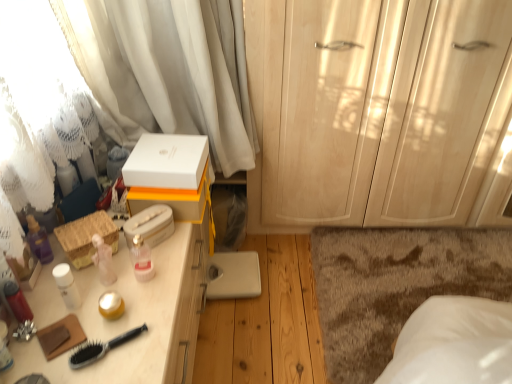
Question: Is white matte box at center, which appears as the third storage box when ordered from the bottom, closer to camera compared to brown shaggy rug at lower right?

Choices:
 (A) yes
 (B) no

Answer: (A)

Question: Is white matte box at center, the first storage box from the top, to the left of brown shaggy rug at lower right from the viewer's perspective?

Choices:
 (A) no
 (B) yes

Answer: (B)

Question: Is the position of white matte box at center, which appears as the third storage box when ordered from the bottom, more distant than that of brown shaggy rug at lower right?

Choices:
 (A) yes
 (B) no

Answer: (B)

Question: Can you confirm if white matte box at center, which appears as the third storage box when ordered from the bottom, is smaller than brown shaggy rug at lower right?

Choices:
 (A) no
 (B) yes

Answer: (B)

Question: Is white matte box at center, which appears as the third storage box when ordered from the bottom, placed right next to brown shaggy rug at lower right?

Choices:
 (A) no
 (B) yes

Answer: (A)

Question: Considering the relative positions of white matte box at center, the first storage box from the top, and white matte tissue box at upper center, positioned as the 2th storage box in top-to-bottom order, in the image provided, is white matte box at center, the first storage box from the top, to the left or to the right of white matte tissue box at upper center, positioned as the 2th storage box in top-to-bottom order,?

Choices:
 (A) right
 (B) left

Answer: (A)

Question: Considering the positions of white matte box at center, which appears as the third storage box when ordered from the bottom, and white matte tissue box at upper center, positioned as the 2th storage box in top-to-bottom order, in the image, is white matte box at center, which appears as the third storage box when ordered from the bottom, bigger or smaller than white matte tissue box at upper center, positioned as the 2th storage box in top-to-bottom order,?

Choices:
 (A) small
 (B) big

Answer: (B)

Question: Does point (159, 187) appear closer or farther from the camera than point (170, 213)?

Choices:
 (A) farther
 (B) closer

Answer: (B)

Question: From a real-world perspective, relative to white matte tissue box at upper center, arranged as the second storage box when ordered from the bottom, is white matte box at center, the first storage box from the top, vertically above or below?

Choices:
 (A) above
 (B) below

Answer: (A)

Question: Is white matte box at center, the first storage box from the top, taller or shorter than matte white lotion at left, placed as the 1th toiletry when sorted from left to right?

Choices:
 (A) short
 (B) tall

Answer: (A)

Question: In the image, is white matte box at center, the first storage box from the top, positioned in front of or behind matte white lotion at left, which is the first toiletry in bottom-to-top order?

Choices:
 (A) front
 (B) behind

Answer: (B)

Question: From the image's perspective, relative to matte white lotion at left, which ranks as the first toiletry in front-to-back order, is white matte box at center, which appears as the third storage box when ordered from the bottom, above or below?

Choices:
 (A) below
 (B) above

Answer: (B)

Question: From a real-world perspective, is white matte box at center, the first storage box from the top, positioned above or below matte white lotion at left, which is the second toiletry in back-to-front order?

Choices:
 (A) above
 (B) below

Answer: (A)

Question: Which is correct: matte white lotion at left, placed as the 1th toiletry when sorted from left to right, is inside woven straw basket at left, the 3th storage box viewed from the top, or outside of it?

Choices:
 (A) inside
 (B) outside

Answer: (B)

Question: From a real-world perspective, is matte white lotion at left, placed as the 1th toiletry when sorted from left to right, positioned above or below woven straw basket at left, arranged as the first storage box when ordered from the bottom?

Choices:
 (A) below
 (B) above

Answer: (A)